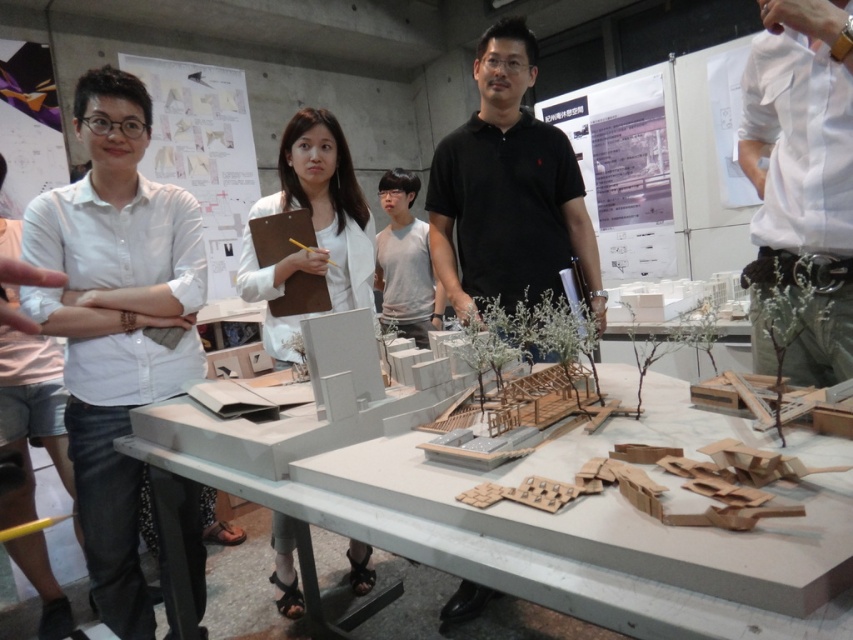
Question: Which of the following is the closest to the observer?

Choices:
 (A) (308, 266)
 (B) (489, 250)

Answer: (A)

Question: Is white cotton shirt at upper right in front of white matte model at center?

Choices:
 (A) no
 (B) yes

Answer: (B)

Question: Among these points, which one is farthest from the camera?

Choices:
 (A) 511,125
 (B) 798,17
 (C) 129,520
 (D) 838,452

Answer: (A)

Question: Is white cotton shirt at upper right thinner than white matte model at center?

Choices:
 (A) yes
 (B) no

Answer: (A)

Question: Which point appears closest to the camera in this image?

Choices:
 (A) (415, 461)
 (B) (137, 461)

Answer: (A)

Question: Does white matte table at center have a smaller size compared to white matte model at center?

Choices:
 (A) yes
 (B) no

Answer: (B)